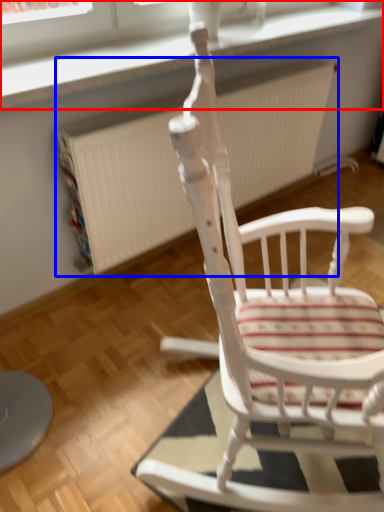
Question: Among these objects, which one is farthest to the camera, window frame (highlighted by a red box) or radiator (highlighted by a blue box)?

Choices:
 (A) window frame
 (B) radiator

Answer: (B)